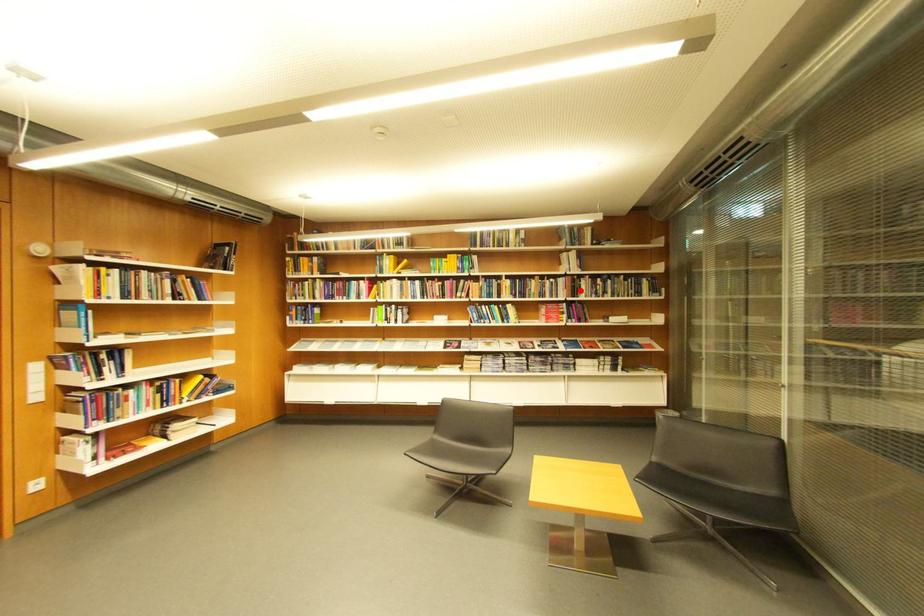
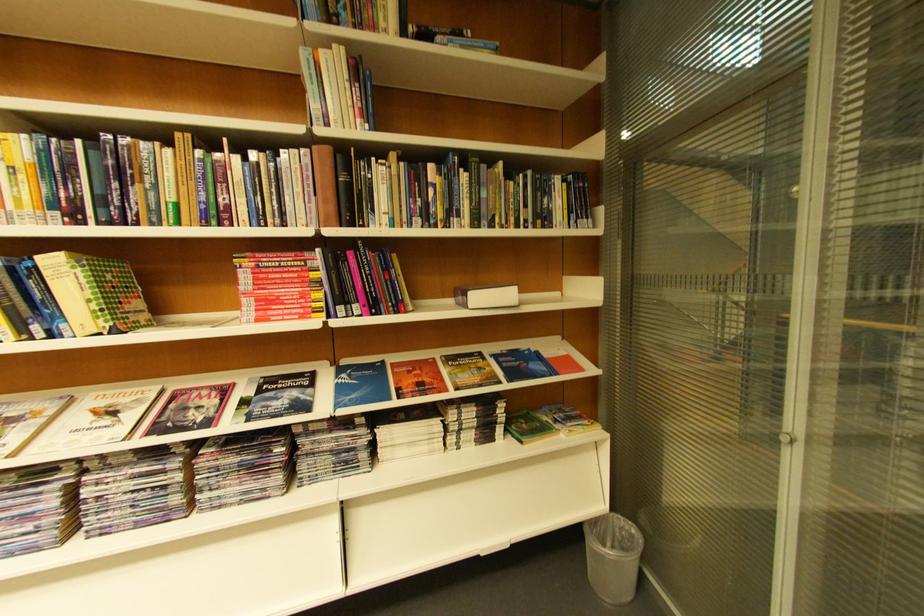
Find the pixel in the second image that matches the highlighted location in the first image.

(342, 196)